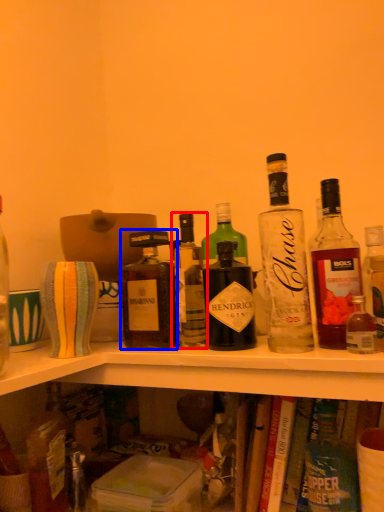
Question: Which object appears closest to the camera in this image, bottle (highlighted by a red box) or bottle (highlighted by a blue box)?

Choices:
 (A) bottle
 (B) bottle

Answer: (A)